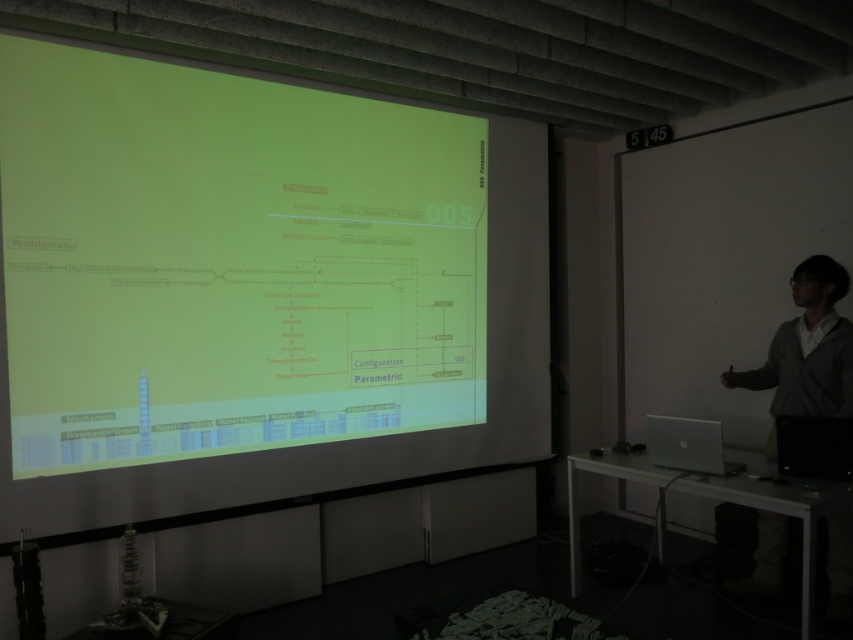
You are an attendee at the presentation and want to take notes on your device. You see the black plastic computer at lower right and the silver metallic laptop at lower right. Which device is easier to reach without moving from your seat?

The black plastic computer at lower right is closer to the viewer than the silver metallic laptop at lower right, so it is easier to reach without moving from your seat.

You are an attendee at the presentation and want to take notes on the slide. You have a gray sweater at right and a black plastic computer at lower right. Which object is closer to the projection screen?

The gray sweater at right is closer to the projection screen because it is located above the black plastic computer at lower right, which is farther down.